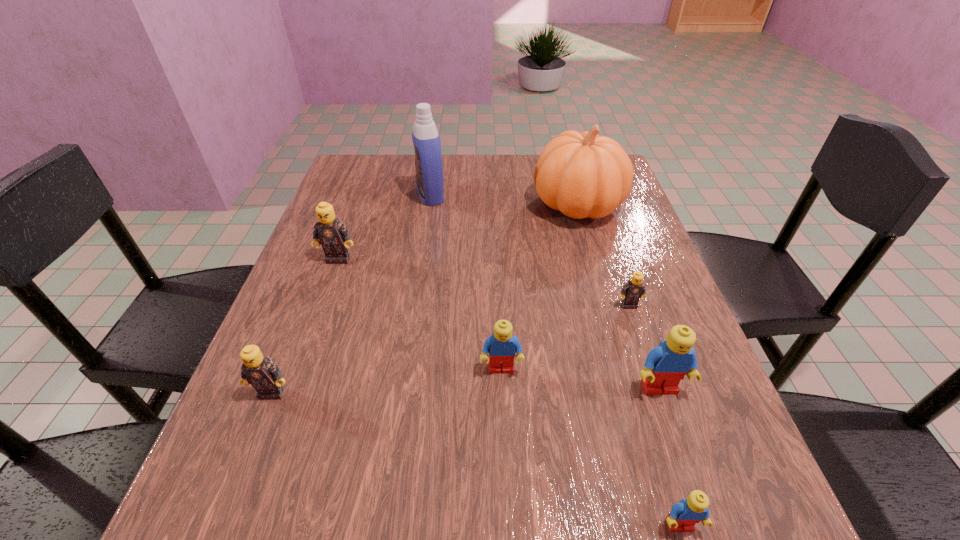
Locate an element on the screen. The height and width of the screenshot is (540, 960). vacant space that is in between the smallest tan Lego and the second biggest tan Lego is located at coordinates 450,349.

I want to click on vacant space that's between the fifth nearest object and the orange pumpkin, so click(x=603, y=255).

I want to click on free spot between the nearest tan Lego and the biggest blue Lego, so click(x=466, y=390).

Locate an element on the screen. The image size is (960, 540). vacant area that lies between the smallest blue Lego and the third farthest object is located at coordinates click(x=509, y=392).

What are the coordinates of `free space between the second biggest tan Lego and the farthest Lego` in the screenshot? It's located at (305, 326).

This screenshot has width=960, height=540. I want to click on empty location between the smallest tan Lego and the biggest blue Lego, so click(x=644, y=347).

The height and width of the screenshot is (540, 960). What are the coordinates of `unoccupied position between the nearest tan Lego and the pumpkin` in the screenshot? It's located at (424, 299).

Identify the location of vacant area that lies between the fourth Lego from right to left and the biggest blue Lego. The width and height of the screenshot is (960, 540). (581, 379).

You are a GUI agent. You are given a task and a screenshot of the screen. Output one action in this format:
    pyautogui.click(x=<x>, y=<y>)
    Task: Click on the blank region between the second biggest blue Lego and the farthest tan Lego
    
    Given the screenshot: What is the action you would take?
    [420, 314]

Locate which object ranks sixth in proximity to the smallest blue Lego. Please provide its 2D coordinates. Your answer should be formatted as a tuple, i.e. [(x, y)], where the tuple contains the x and y coordinates of a point satisfying the conditions above.

[(333, 235)]